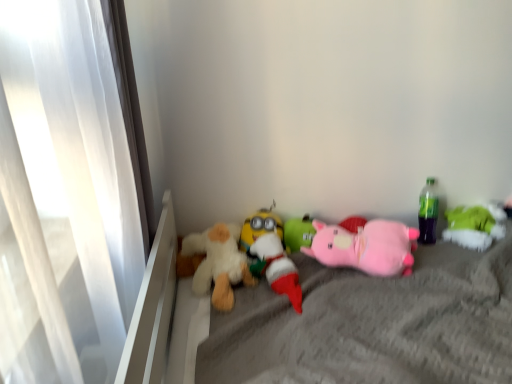
Question: In the image, is soft gray fabric mattress at center on the left side or the right side of pink plush pig at center, the second toy viewed from the right?

Choices:
 (A) right
 (B) left

Answer: (A)

Question: Is soft gray fabric mattress at center taller or shorter than pink plush pig at center, the second toy viewed from the right?

Choices:
 (A) short
 (B) tall

Answer: (B)

Question: Estimate the real-world distances between objects in this image. Which object is farther from the green fabric pillow at right, which ranks as the first toy in right-to-left order?

Choices:
 (A) green plush toy at center, positioned as the third toy in right-to-left order
 (B) fluffy white teddy bear at center, acting as the 1th toy starting from the left
 (C) white plush toy at center, the third toy when ordered from left to right
 (D) soft gray fabric mattress at center
 (E) yellow plush toy at center, the fifth toy in the right-to-left sequence

Answer: (B)

Question: Estimate the real-world distances between objects in this image. Which object is farther from the green fabric pillow at right, which is the 6th toy from left to right?

Choices:
 (A) fluffy white teddy bear at center, positioned as the 6th toy in right-to-left order
 (B) yellow plush toy at center, which is the 2th toy from left to right
 (C) white plush toy at center, the third toy when ordered from left to right
 (D) green plush toy at center, positioned as the third toy in right-to-left order
 (E) soft gray fabric mattress at center

Answer: (A)